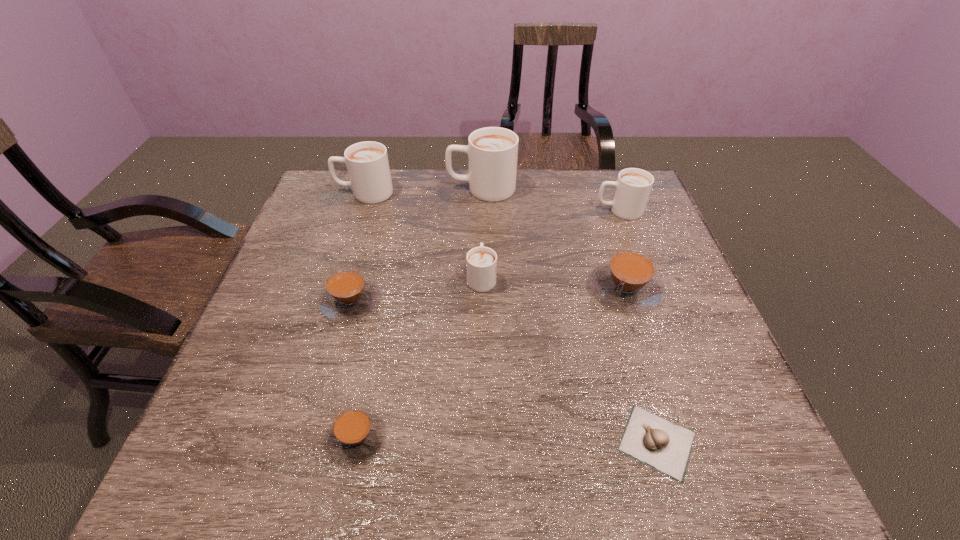
Locate an element on the screen. object that is at the near right corner is located at coordinates (665, 446).

At what (x,y) coordinates should I click in order to perform the action: click on free space at the far edge. Please return your answer as a coordinate pair (x, y). This screenshot has width=960, height=540. Looking at the image, I should click on (408, 190).

This screenshot has width=960, height=540. I want to click on vacant space at the near edge of the desktop, so click(x=297, y=464).

Image resolution: width=960 pixels, height=540 pixels. I want to click on free spot at the left edge of the desktop, so click(311, 318).

At what (x,y) coordinates should I click in order to perform the action: click on free space at the right edge of the desktop. Please return your answer as a coordinate pair (x, y). This screenshot has width=960, height=540. Looking at the image, I should click on (660, 320).

In order to click on vacant space at the far left corner of the desktop in this screenshot , I will do `click(328, 193)`.

Find the location of a particular element. Image resolution: width=960 pixels, height=540 pixels. vacant space that is in between the rightmost brown cappuccino and the second tallest object is located at coordinates (494, 240).

At what (x,y) coordinates should I click in order to perform the action: click on free spot between the rightmost brown cappuccino and the shortest object. Please return your answer as a coordinate pair (x, y). This screenshot has height=540, width=960. Looking at the image, I should click on 641,365.

Identify the location of free spot between the shortest object and the smallest white cappuccino. (569, 359).

Locate an element on the screen. The image size is (960, 540). vacant area that lies between the nearest cappuccino and the smallest white cappuccino is located at coordinates (420, 357).